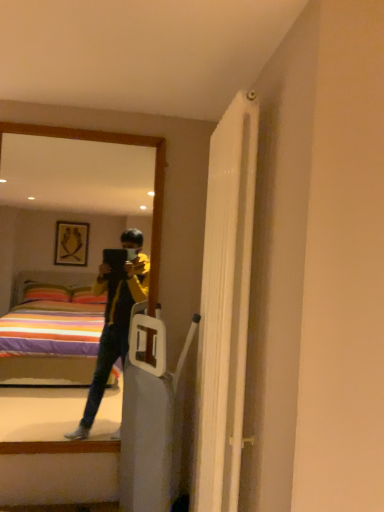
Question: From the image's perspective, is white textured radiator at upper right located above or below matte black mirror at left?

Choices:
 (A) above
 (B) below

Answer: (B)

Question: Visually, is white textured radiator at upper right positioned to the left or to the right of matte black mirror at left?

Choices:
 (A) right
 (B) left

Answer: (A)

Question: From their relative heights in the image, would you say white textured radiator at upper right is taller or shorter than matte black mirror at left?

Choices:
 (A) tall
 (B) short

Answer: (A)

Question: From the image's perspective, is matte black mirror at left positioned above or below white textured radiator at upper right?

Choices:
 (A) below
 (B) above

Answer: (B)

Question: Would you say matte black mirror at left is to the left or to the right of white textured radiator at upper right in the picture?

Choices:
 (A) left
 (B) right

Answer: (A)

Question: Is matte black mirror at left wider or thinner than white textured radiator at upper right?

Choices:
 (A) thin
 (B) wide

Answer: (A)

Question: In the image, is matte black mirror at left positioned in front of or behind white textured radiator at upper right?

Choices:
 (A) behind
 (B) front

Answer: (A)